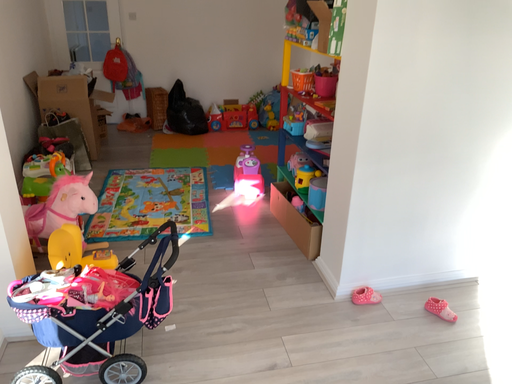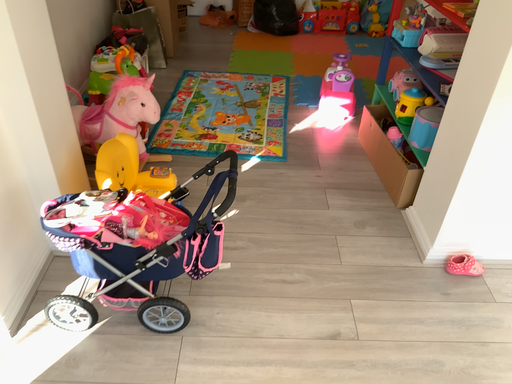
Question: Which way did the camera rotate in the video?

Choices:
 (A) rotated upward
 (B) rotated downward

Answer: (B)